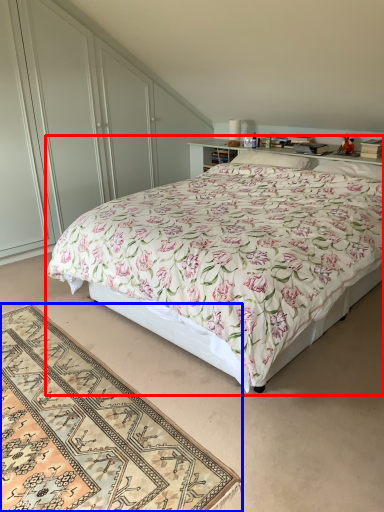
Question: Which point is closer to the camera, bed (highlighted by a red box) or mat (highlighted by a blue box)?

Choices:
 (A) bed
 (B) mat

Answer: (B)